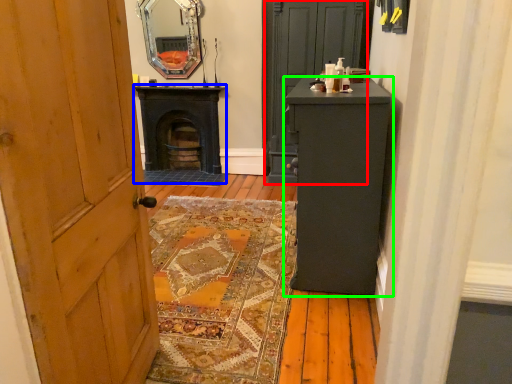
Question: Which is nearer to the door (highlighted by a red box)? stove (highlighted by a blue box) or furniture (highlighted by a green box).

Choices:
 (A) stove
 (B) furniture

Answer: (A)